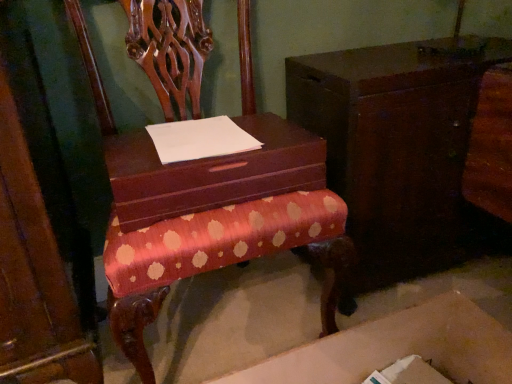
Question: Which is correct: matte brown shoe box at center is inside cardboard box at lower center, or outside of it?

Choices:
 (A) outside
 (B) inside

Answer: (A)

Question: Considering the positions of matte brown shoe box at center and cardboard box at lower center in the image, is matte brown shoe box at center bigger or smaller than cardboard box at lower center?

Choices:
 (A) small
 (B) big

Answer: (A)

Question: Which object is the farthest from the cardboard box at lower center?

Choices:
 (A) white paper at center
 (B) polished wood chair at center
 (C) wooden cabinet at center
 (D) matte brown shoe box at center

Answer: (A)

Question: Considering the real-world distances, which object is farthest from the white paper at center?

Choices:
 (A) wooden cabinet at center
 (B) cardboard box at lower center
 (C) matte brown shoe box at center
 (D) polished wood chair at center

Answer: (B)